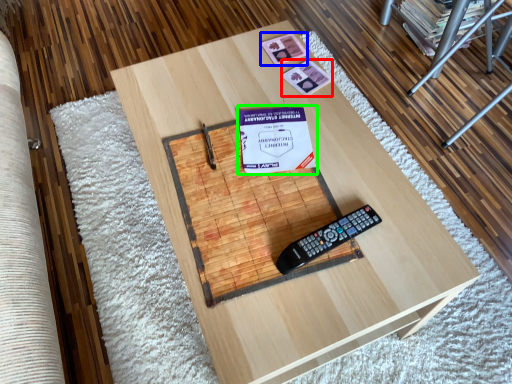
Question: Considering the real-world distances, which object is farthest from square (highlighted by a red box)? square (highlighted by a blue box) or paperback book (highlighted by a green box)?

Choices:
 (A) square
 (B) paperback book

Answer: (B)